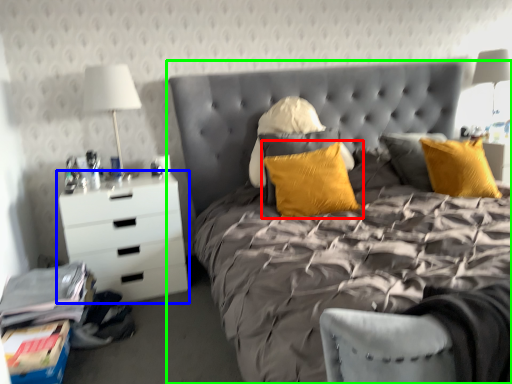
Question: Considering the real-world distances, which object is closest to pillow (highlighted by a red box)? chest of drawers (highlighted by a blue box) or bed (highlighted by a green box).

Choices:
 (A) chest of drawers
 (B) bed

Answer: (B)